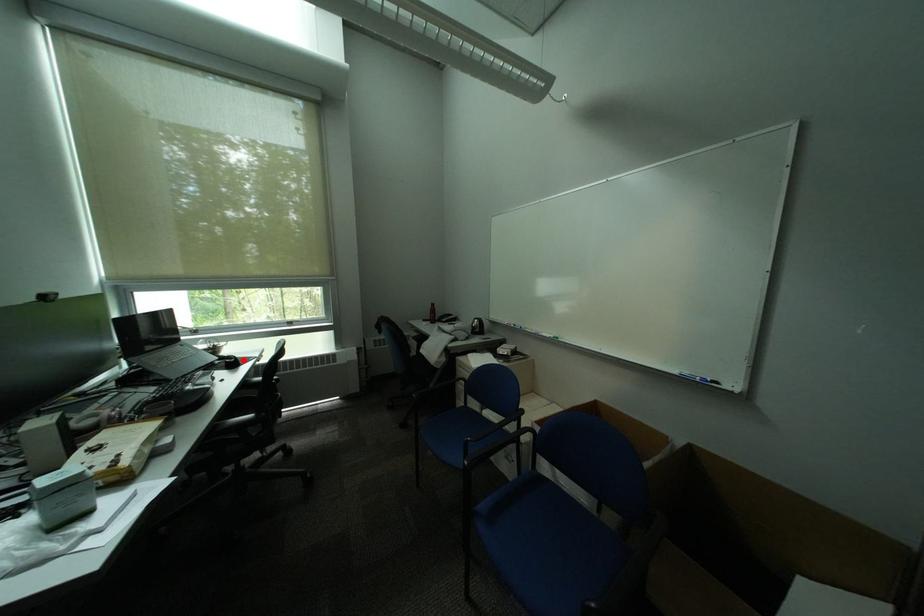
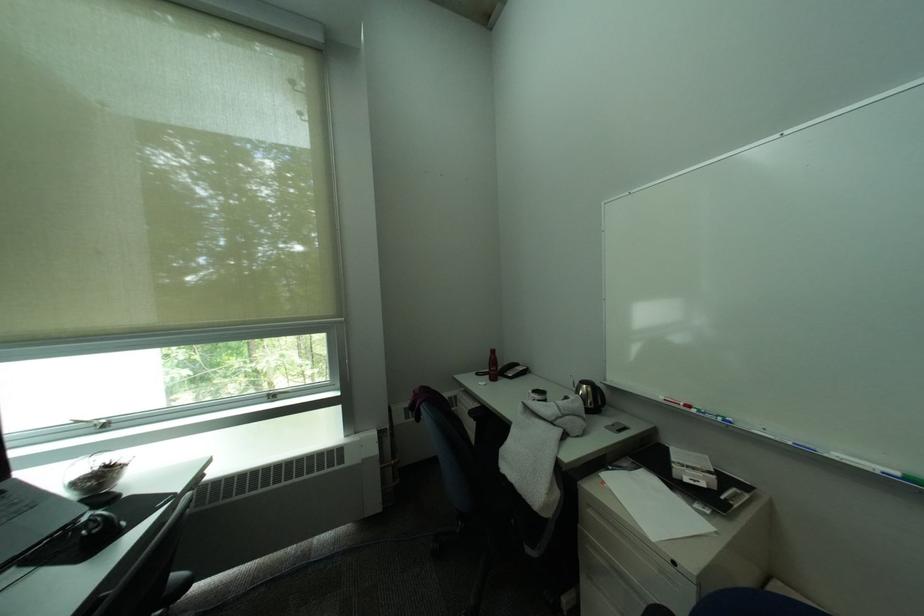
Where in the second image is the point corresponding to the highlighted location from the first image?

(106, 528)